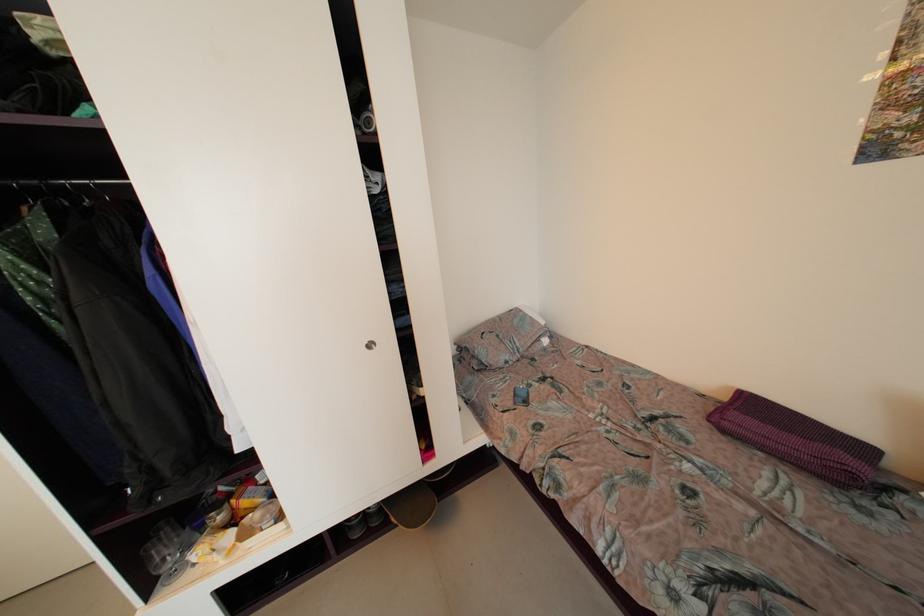
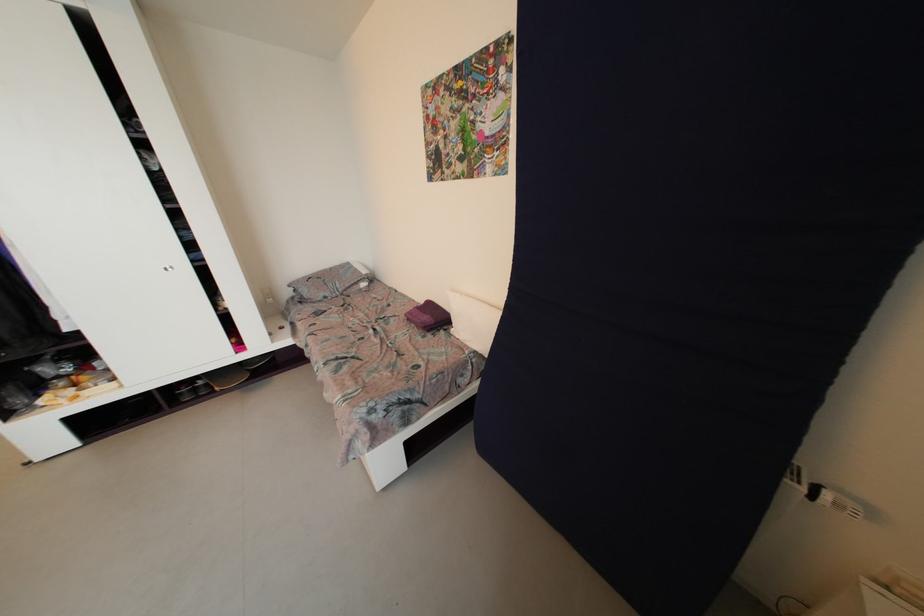
From the picture: Which direction would the cameraman need to move to produce the second image?

The movement direction of the cameraman is right, backward.